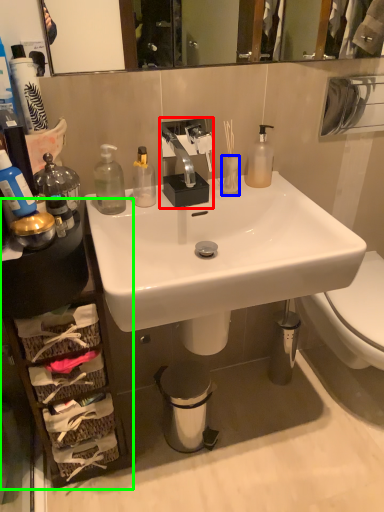
Question: Which is nearer to the sink (highlighted by a red box)? toilet paper (highlighted by a blue box) or cabinetry (highlighted by a green box).

Choices:
 (A) toilet paper
 (B) cabinetry

Answer: (A)